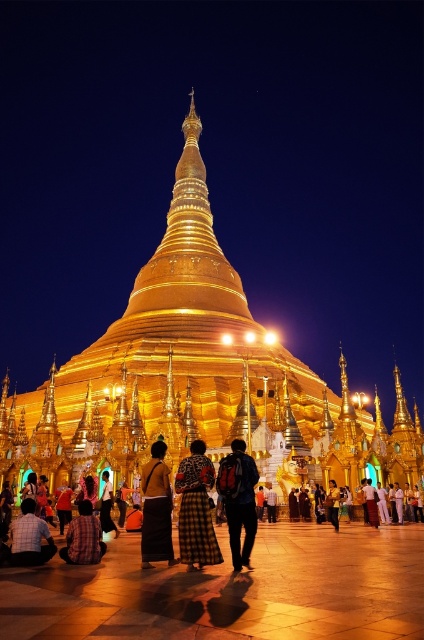
Question: Does golden polished pagoda at center lie in front of yellow fabric bag at center?

Choices:
 (A) no
 (B) yes

Answer: (A)

Question: Which is farther from the golden polished pagoda at center?

Choices:
 (A) plaid fabric skirt at center
 (B) matte black shirt at lower left
 (C) golden silk skirt at center
 (D) plaid fabric pants at lower left

Answer: (B)

Question: Can you confirm if golden silk skirt at center is positioned to the right of matte black shirt at lower left?

Choices:
 (A) yes
 (B) no

Answer: (A)

Question: Which object is the farthest from the black fabric dress at center?

Choices:
 (A) plaid fabric skirt at center
 (B) golden polished pagoda at center

Answer: (B)

Question: Among these points, which one is nearest to the camera?

Choices:
 (A) (103, 490)
 (B) (89, 522)

Answer: (B)

Question: Observing the image, what is the correct spatial positioning of plaid fabric skirt at center in reference to matte black shirt at lower left?

Choices:
 (A) left
 (B) right

Answer: (B)